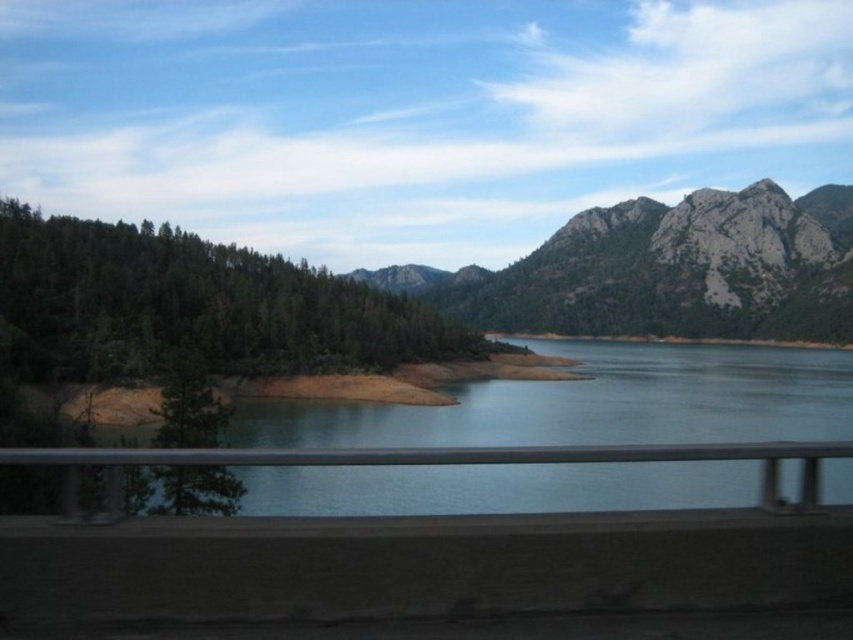
Does green matte forest at left appear under gray rocky mountain at upper right?

Yes.

Which is in front, point (253, 339) or point (730, 198)?

Positioned in front is point (253, 339).

Where is `green matte forest at left`? This screenshot has height=640, width=853. green matte forest at left is located at coordinates (198, 305).

Between green matte forest at left and green matte tree at lower left, which one is positioned higher?

Positioned higher is green matte forest at left.

What do you see at coordinates (198, 305) in the screenshot? The height and width of the screenshot is (640, 853). I see `green matte forest at left` at bounding box center [198, 305].

The width and height of the screenshot is (853, 640). I want to click on green matte forest at left, so click(198, 305).

This screenshot has width=853, height=640. What do you see at coordinates (666, 269) in the screenshot?
I see `gray rocky mountain at upper right` at bounding box center [666, 269].

Looking at this image, does gray rocky mountain at upper right have a greater height compared to green matte tree at lower left?

Indeed, gray rocky mountain at upper right has a greater height compared to green matte tree at lower left.

Is point (683, 273) closer to viewer compared to point (181, 358)?

That is False.

You are a GUI agent. You are given a task and a screenshot of the screen. Output one action in this format:
    pyautogui.click(x=<x>, y=<y>)
    Task: Click on the gray rocky mountain at upper right
    
    Given the screenshot: What is the action you would take?
    pyautogui.click(x=666, y=269)